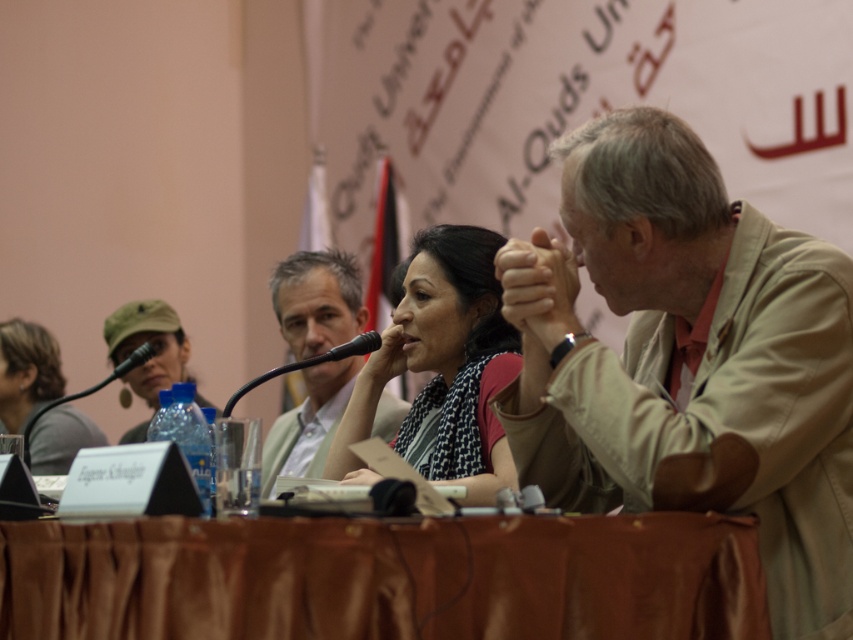
Question: Which object is closer to the camera taking this photo?

Choices:
 (A) matte black scarf at center
 (B) tan fabric jacket at center
 (C) black plastic microphone at center
 (D) brown satin table at center

Answer: (D)

Question: Among these points, which one is nearest to the camera?

Choices:
 (A) (544, 244)
 (B) (556, 563)
 (C) (351, 355)

Answer: (B)

Question: Which is nearer to the black plastic microphone at center?

Choices:
 (A) tan fabric jacket at center
 (B) matte gray shirt at lower left
 (C) matte black scarf at center
 (D) matte green shirt at center

Answer: (D)

Question: Considering the relative positions of matte black scarf at center and matte gray shirt at lower left in the image provided, where is matte black scarf at center located with respect to matte gray shirt at lower left?

Choices:
 (A) left
 (B) right

Answer: (B)

Question: In this image, where is tan fabric jacket at center located relative to black plastic microphone at center?

Choices:
 (A) below
 (B) above

Answer: (A)

Question: Does matte gray shirt at lower left have a greater width compared to black plastic microphone at center?

Choices:
 (A) no
 (B) yes

Answer: (B)